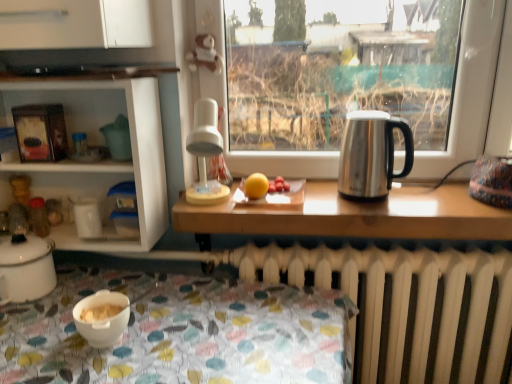
Question: Would you say smooth red tomatoes at center is inside or outside white matte bowl at lower left?

Choices:
 (A) outside
 (B) inside

Answer: (A)

Question: In the image, is smooth red tomatoes at center on the left side or the right side of white matte bowl at lower left?

Choices:
 (A) right
 (B) left

Answer: (A)

Question: Which object is positioned farthest from the white plastic lamp at center?

Choices:
 (A) yellow matte orange at center
 (B) white glossy shelves at left
 (C) white matte bowl at lower left
 (D) smooth red tomatoes at center
 (E) white enamel pot at lower left

Answer: (E)

Question: Which of these objects is positioned farthest from the smooth red tomatoes at center?

Choices:
 (A) stainless steel kettle at right
 (B) white enamel pot at lower left
 (C) white glossy shelves at left
 (D) white matte bowl at lower left
 (E) yellow matte orange at center

Answer: (B)